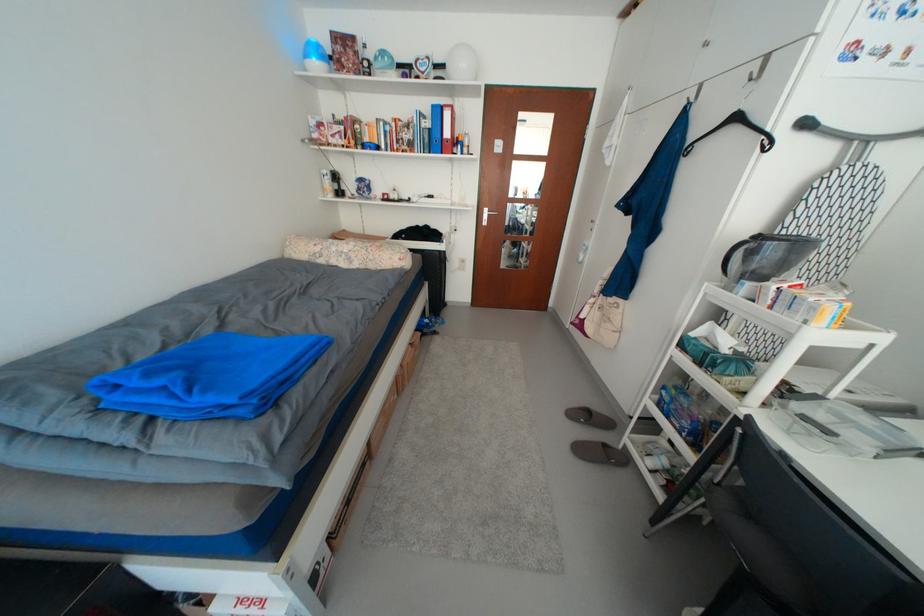
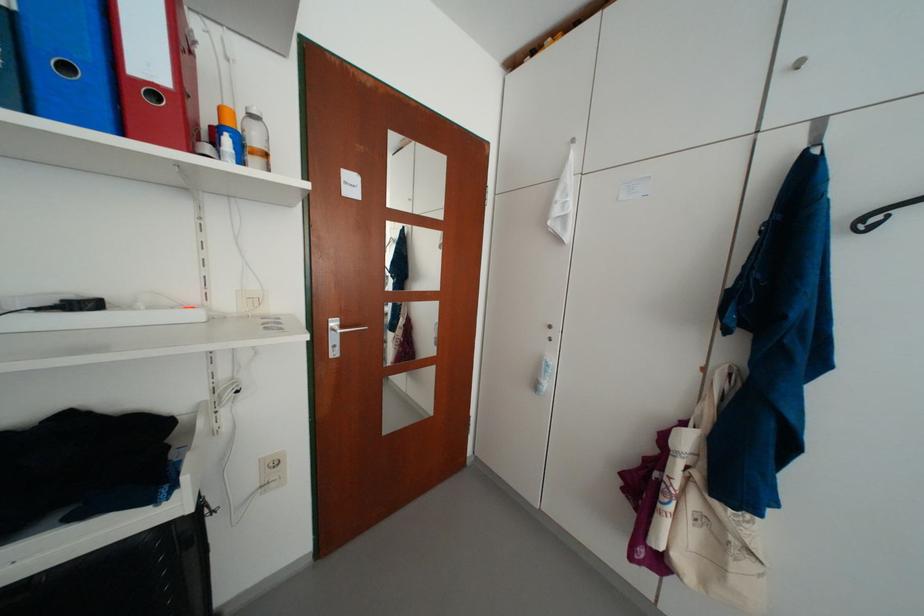
Find the pixel in the second image that matches point (473, 152) in the first image.

(263, 163)